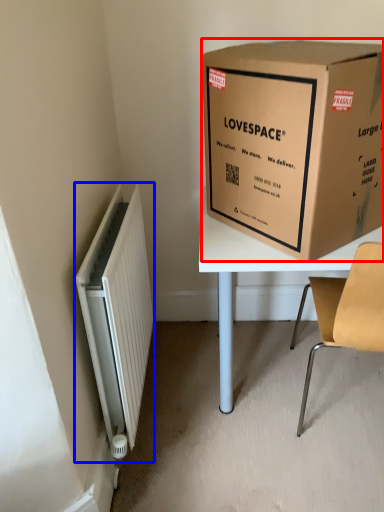
Question: Which point is further to the camera, box (highlighted by a red box) or radiator (highlighted by a blue box)?

Choices:
 (A) box
 (B) radiator

Answer: (B)